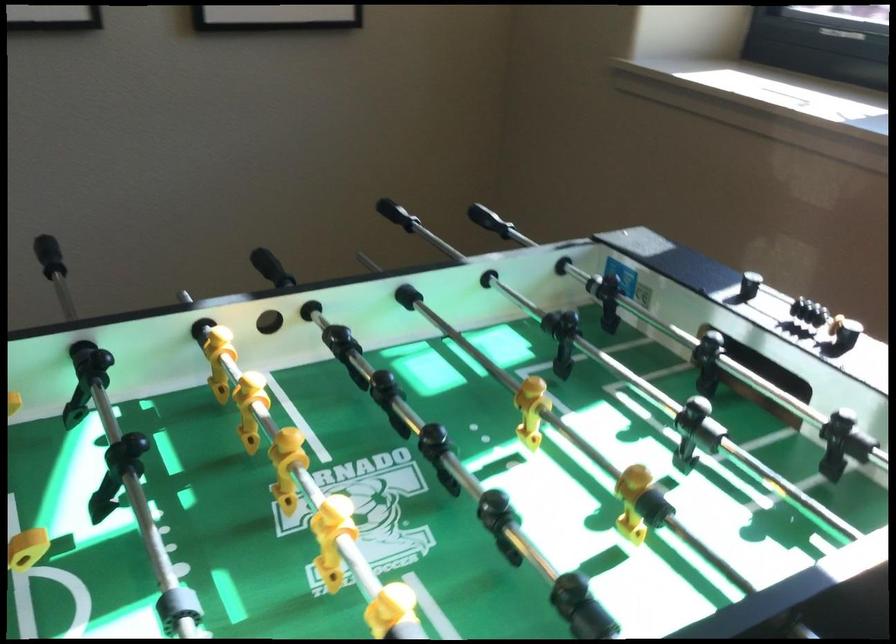
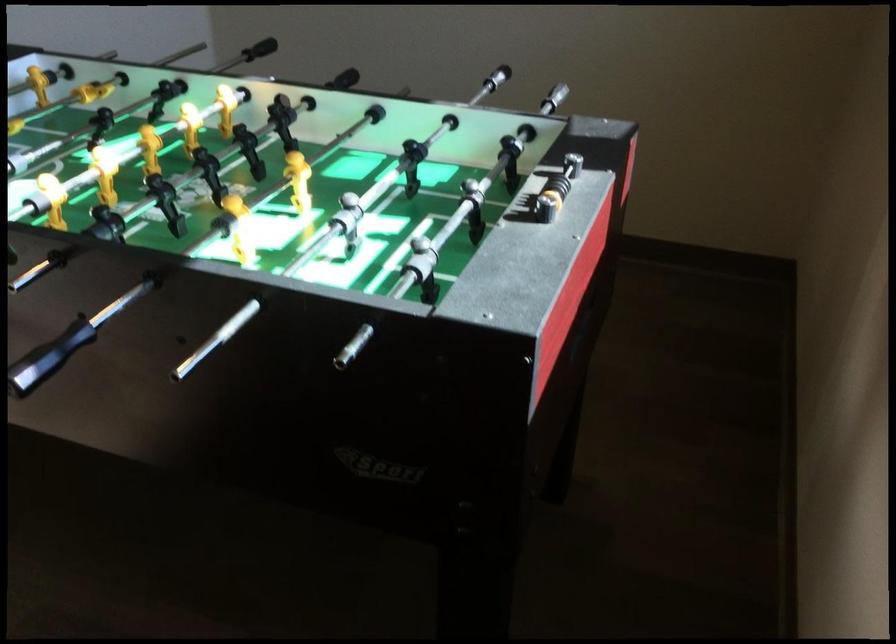
Find the pixel in the second image that matches pixel 177 218 in the first image.

(496, 78)